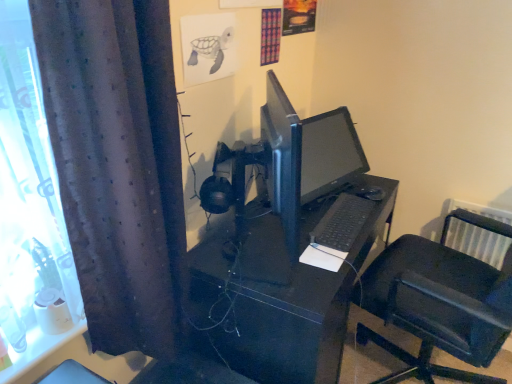
Find the location of a particular element. The width and height of the screenshot is (512, 384). black matte desk at center is located at coordinates (288, 296).

What do you see at coordinates (118, 165) in the screenshot? I see `dark purple fabric curtain at left` at bounding box center [118, 165].

The width and height of the screenshot is (512, 384). What do you see at coordinates (306, 153) in the screenshot?
I see `black glossy monitor at center` at bounding box center [306, 153].

At what (x,y) coordinates should I click in order to perform the action: click on black matte desk at center. Please return your answer as a coordinate pair (x, y). The image size is (512, 384). Looking at the image, I should click on (288, 296).

Is dark purple fabric curtain at left oriented towards black glossy monitor at center?

No, dark purple fabric curtain at left does not turn towards black glossy monitor at center.

Is dark purple fabric curtain at left shorter than black glossy monitor at center?

No, dark purple fabric curtain at left is not shorter than black glossy monitor at center.

Is point (127, 205) closer or farther from the camera than point (342, 135)?

Point (127, 205) is closer to the camera than point (342, 135).

From the picture: Can you tell me how much dark purple fabric curtain at left and black glossy monitor at center differ in facing direction?

There is a 11-degree angle between the facing directions of dark purple fabric curtain at left and black glossy monitor at center.

Identify the location of computer keyboard on the right of black glossy monitor at center. The height and width of the screenshot is (384, 512). (342, 222).

Between black matte keyboard at center and black glossy monitor at center, which one appears on the right side from the viewer's perspective?

black matte keyboard at center is more to the right.

Considering the positions of points (362, 211) and (273, 194), is point (362, 211) farther from camera compared to point (273, 194)?

Yes, it is behind point (273, 194).

How many degrees apart are the facing directions of black matte keyboard at center and black glossy monitor at center?

16.7 degrees.

Between black matte desk at center and black plastic chair at right, which one has smaller width?

black matte desk at center is thinner.

From a real-world perspective, is black matte desk at center physically above black plastic chair at right?

No, from a real-world perspective, black matte desk at center is not above black plastic chair at right.

Does black matte desk at center turn towards black plastic chair at right?

Yes, black matte desk at center is turned towards black plastic chair at right.

Is black plastic chair at right located within black matte desk at center?

No, black plastic chair at right is located outside of black matte desk at center.

From the image's perspective, would you say black plastic chair at right is shown under dark purple fabric curtain at left?

Yes, from the image's perspective, black plastic chair at right is below dark purple fabric curtain at left.

Visually, is black plastic chair at right positioned to the left or to the right of dark purple fabric curtain at left?

In the image, black plastic chair at right appears on the right side of dark purple fabric curtain at left.

Does black plastic chair at right have a lesser height compared to dark purple fabric curtain at left?

No, black plastic chair at right is not shorter than dark purple fabric curtain at left.

Would you say black plastic chair at right is inside or outside dark purple fabric curtain at left?

black plastic chair at right is located beyond the bounds of dark purple fabric curtain at left.

Do you think dark purple fabric curtain at left is within black matte keyboard at center, or outside of it?

dark purple fabric curtain at left is located beyond the bounds of black matte keyboard at center.

Which of these two, dark purple fabric curtain at left or black matte keyboard at center, is smaller?

black matte keyboard at center is smaller.

Is dark purple fabric curtain at left positioned with its back to black matte keyboard at center?

That's not correct — dark purple fabric curtain at left is not looking away from black matte keyboard at center.

How many degrees apart are the facing directions of dark purple fabric curtain at left and black matte keyboard at center?

5.71 degrees.

Does black matte desk at center appear on the left side of black glossy monitor at center?

Indeed, black matte desk at center is positioned on the left side of black glossy monitor at center.

Is the depth of black matte desk at center greater than that of black glossy monitor at center?

No, black matte desk at center is closer to the camera.

Does black matte desk at center have a lesser width compared to black glossy monitor at center?

Incorrect, the width of black matte desk at center is not less than that of black glossy monitor at center.

From a real-world perspective, which object rests below the other?

In real-world perspective, black plastic chair at right is lower.

Can black plastic chair at right be found inside black glossy monitor at center?

No, black plastic chair at right is not a part of black glossy monitor at center.

From the picture: From the image's perspective, which one is positioned higher, black glossy monitor at center or black plastic chair at right?

black glossy monitor at center, from the image's perspective.

Can you confirm if black glossy monitor at center is smaller than black plastic chair at right?

Indeed, black glossy monitor at center has a smaller size compared to black plastic chair at right.

Identify the location of computer monitor above the dark purple fabric curtain at left (from the image's perspective). This screenshot has width=512, height=384. (306, 153).

Locate an element on the screen. computer monitor above the black matte keyboard at center (from a real-world perspective) is located at coordinates (306, 153).

Based on their spatial positions, is black matte desk at center or black glossy monitor at center further from black plastic chair at right?

black glossy monitor at center is positioned further to the anchor black plastic chair at right.

Based on their spatial positions, is dark purple fabric curtain at left or black matte keyboard at center further from black plastic chair at right?

dark purple fabric curtain at left is further to black plastic chair at right.

Considering their positions, is black matte keyboard at center positioned further to black glossy monitor at center than dark purple fabric curtain at left?

Based on the image, dark purple fabric curtain at left appears to be further to black glossy monitor at center.

Estimate the real-world distances between objects in this image. Which object is further from dark purple fabric curtain at left, black glossy monitor at center or black plastic chair at right?

black plastic chair at right is positioned further to the anchor dark purple fabric curtain at left.

From the image, which object appears to be nearer to black matte keyboard at center, black glossy monitor at center or dark purple fabric curtain at left?

Among the two, black glossy monitor at center is located nearer to black matte keyboard at center.

Estimate the real-world distances between objects in this image. Which object is further from dark purple fabric curtain at left, black plastic chair at right or black matte desk at center?

Based on the image, black plastic chair at right appears to be further to dark purple fabric curtain at left.

Which object lies further to the anchor point black matte keyboard at center, black plastic chair at right or black glossy monitor at center?

Based on the image, black plastic chair at right appears to be further to black matte keyboard at center.

When comparing their distances from black plastic chair at right, does black glossy monitor at center or black matte desk at center seem further?

black glossy monitor at center is further to black plastic chair at right.

The width and height of the screenshot is (512, 384). I want to click on desk situated between dark purple fabric curtain at left and black plastic chair at right from left to right, so pos(288,296).

Where is `computer monitor between dark purple fabric curtain at left and black matte keyboard at center in the front-back direction`? The image size is (512, 384). computer monitor between dark purple fabric curtain at left and black matte keyboard at center in the front-back direction is located at coordinates (306, 153).

I want to click on desk between dark purple fabric curtain at left and black matte keyboard at center from front to back, so click(288, 296).

The width and height of the screenshot is (512, 384). Find the location of `computer keyboard situated between black matte desk at center and black plastic chair at right from left to right`. computer keyboard situated between black matte desk at center and black plastic chair at right from left to right is located at coordinates (342, 222).